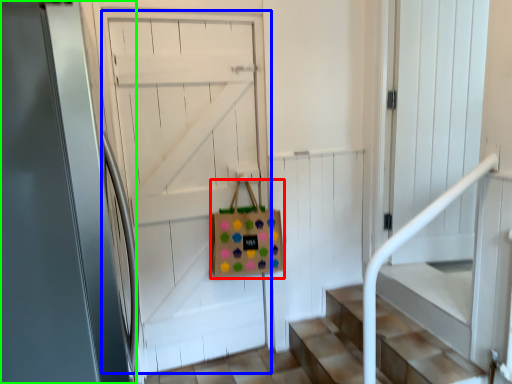
Question: Estimate the real-world distances between objects in this image. Which object is farther from shopping bag (highlighted by a red box), door (highlighted by a blue box) or door (highlighted by a green box)?

Choices:
 (A) door
 (B) door

Answer: (B)